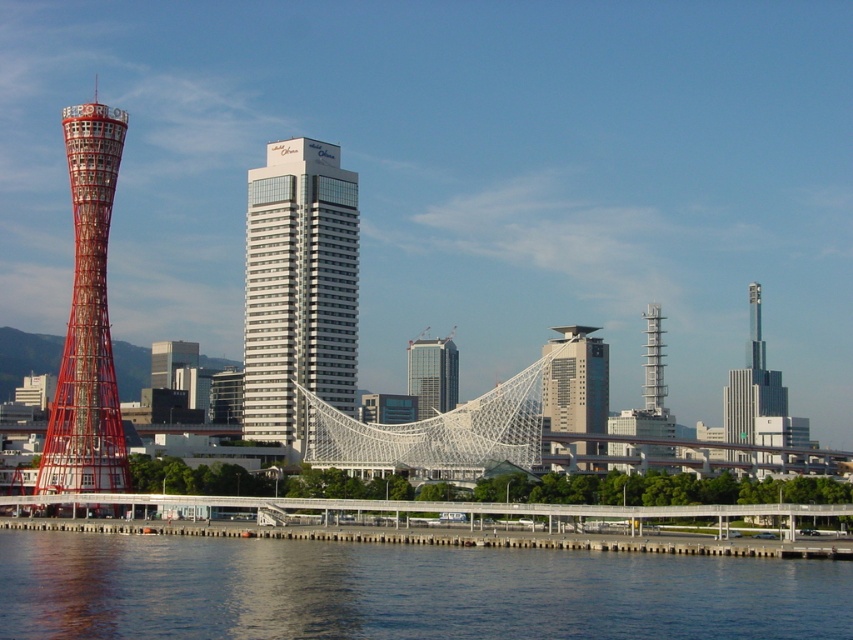
Question: Can you confirm if blue water at lower left is positioned above metallic gray bridge at lower center?

Choices:
 (A) no
 (B) yes

Answer: (B)

Question: Where is metallic gray bridge at lower center located in relation to matte glass skyscraper at center in the image?

Choices:
 (A) below
 (B) above

Answer: (A)

Question: Which object appears farthest from the camera in this image?

Choices:
 (A) white glass building at center
 (B) matte glass skyscraper at center
 (C) silver metallic skyscraper at right

Answer: (C)

Question: Which point is farther to the camera?

Choices:
 (A) (22, 512)
 (B) (338, 188)

Answer: (B)

Question: Does white glass building at center have a larger size compared to metallic gray bridge at lower center?

Choices:
 (A) no
 (B) yes

Answer: (B)

Question: Based on their relative distances, which object is farther from the metallic silver tower at right?

Choices:
 (A) white glass building at center
 (B) silver metallic skyscraper at right
 (C) glassy reflective skyscraper at center

Answer: (A)